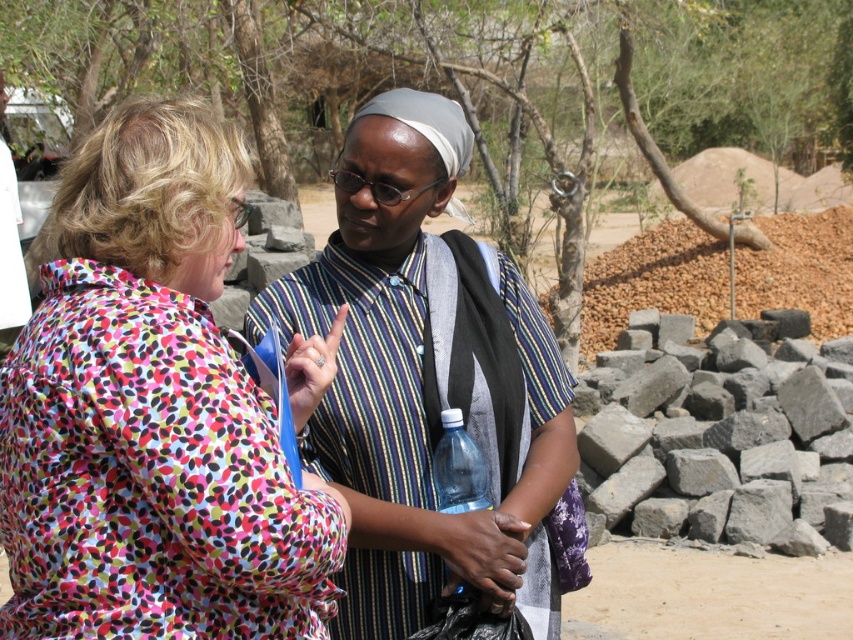
Question: Which is nearer to the striped fabric shirt at center?

Choices:
 (A) gray rough stone at right
 (B) clear plastic bottle at center

Answer: (B)

Question: Is white fabric shirt at upper left smaller than clear plastic bottle at center?

Choices:
 (A) no
 (B) yes

Answer: (A)

Question: Is printed fabric blouse at center below clear plastic bottle at center?

Choices:
 (A) yes
 (B) no

Answer: (B)

Question: Does striped fabric shirt at center appear on the left side of gray rough stone at right?

Choices:
 (A) yes
 (B) no

Answer: (A)

Question: Which object is positioned closest to the striped fabric shirt at center?

Choices:
 (A) clear plastic bottle at center
 (B) printed fabric blouse at center
 (C) white fabric shirt at upper left

Answer: (A)

Question: Among these objects, which one is nearest to the camera?

Choices:
 (A) striped fabric shirt at center
 (B) white fabric shirt at upper left

Answer: (A)